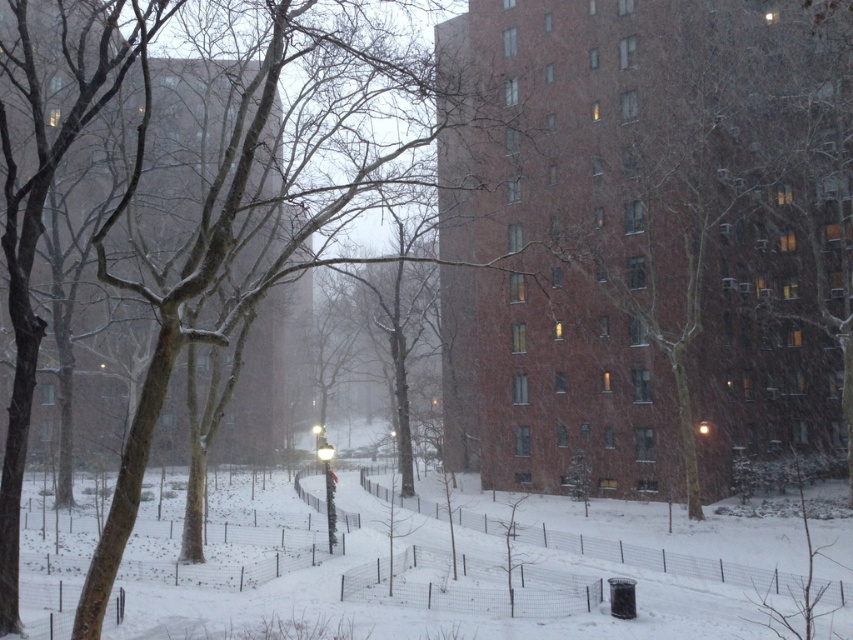
You are a delivery person trying to walk along the snow path. You see the bare branches at center and the white fluffy snow at center. Which one is closer to your right side?

The bare branches at center is to the right of white fluffy snow at center, so the bare branches at center is closer to your right side.

Looking at this image, you are a city planner reviewing this winter scene. You need to determine if the bare branches at center and the brown bark tree at center can both be seen from the pathway. Given their height difference, which one is more likely to block the view of the other?

The bare branches at center is much taller as brown bark tree at center, so it is more likely to block the view of the brown bark tree at center.

You are standing at the point closest to the camera in the snowy path. There are two points marked in the scene, one at coordinate point (251, 120) and another at point (364, 600). Which point is farther away from your current position?

Point (251, 120) is behind point (364, 600), so the point farther away from your current position is point (251, 120).